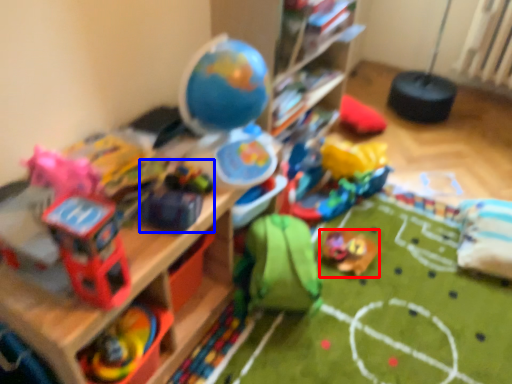
Question: Which object appears farthest to the camera in this image, toy (highlighted by a red box) or toy (highlighted by a blue box)?

Choices:
 (A) toy
 (B) toy

Answer: (A)